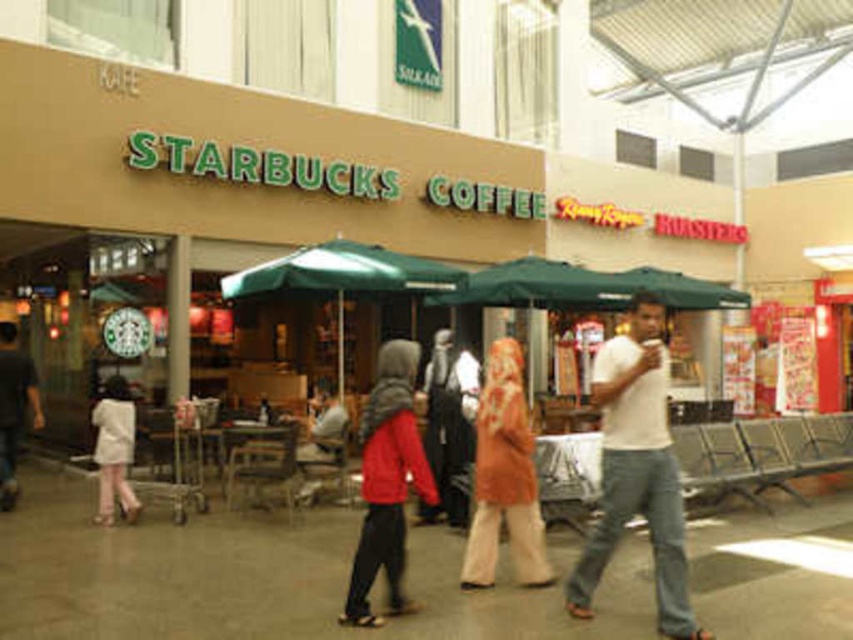
Question: Considering the real-world distances, which object is farthest from the green fabric canopy at center?

Choices:
 (A) red matte jacket at center
 (B) white fabric coat at lower left
 (C) white cotton t-shirt at center

Answer: (C)

Question: Which is nearer to the white cotton t-shirt at center?

Choices:
 (A) light brown leather jacket at lower left
 (B) orange fabric hijab at center

Answer: (B)

Question: Which object appears farthest from the camera in this image?

Choices:
 (A) light brown leather jacket at lower left
 (B) black fabric jacket at center
 (C) red matte jacket at center
 (D) green fabric canopy at center

Answer: (D)

Question: Is the position of white cotton t-shirt at center less distant than that of light brown leather jacket at lower left?

Choices:
 (A) no
 (B) yes

Answer: (B)

Question: Can you confirm if white cotton t-shirt at center is wider than light brown leather jacket at lower left?

Choices:
 (A) no
 (B) yes

Answer: (B)

Question: Is the position of orange fabric hijab at center more distant than that of green fabric canopy at center?

Choices:
 (A) yes
 (B) no

Answer: (B)